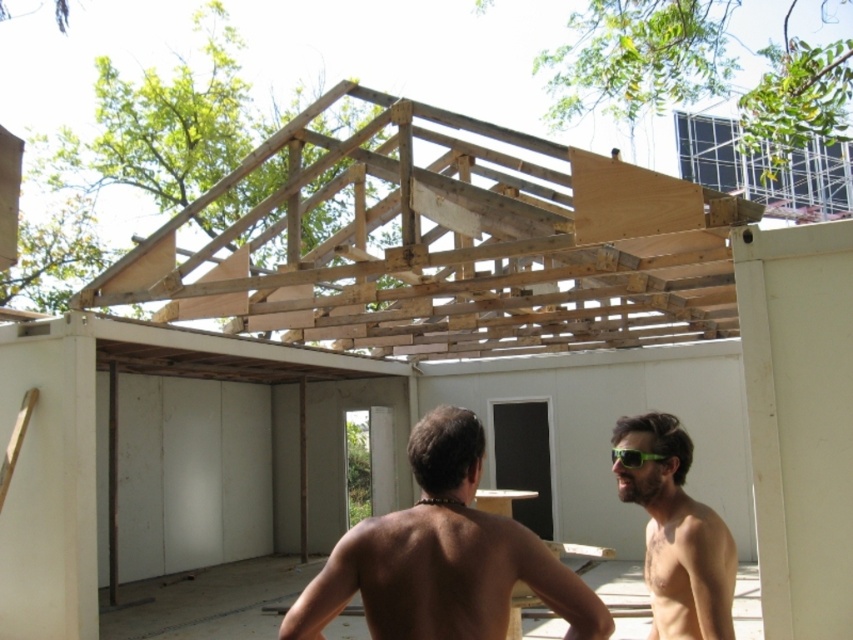
Question: Is brown skin at center wider than green matte sunglasses at center?

Choices:
 (A) no
 (B) yes

Answer: (B)

Question: Considering the real-world distances, which object is closest to the natural wood roof at upper center?

Choices:
 (A) green matte sunglasses at right
 (B) green matte sunglasses at center

Answer: (A)

Question: Which point is closer to the camera?

Choices:
 (A) (155, 269)
 (B) (660, 444)

Answer: (B)

Question: Can you confirm if brown skin at center is bigger than green matte sunglasses at right?

Choices:
 (A) no
 (B) yes

Answer: (B)

Question: Can you confirm if natural wood roof at upper center is bigger than green matte sunglasses at center?

Choices:
 (A) yes
 (B) no

Answer: (A)

Question: Which point is closer to the camera?

Choices:
 (A) green matte sunglasses at right
 (B) brown skin at center
 (C) green matte sunglasses at center
 (D) natural wood roof at upper center

Answer: (B)